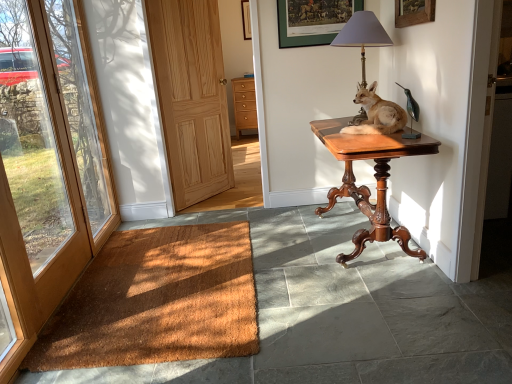
Question: Considering their positions, is wooden picture frame at upper center, which appears as the 1th picture frame when viewed from the left, located in front of or behind light brown wood door at center, the 2th door when ordered from left to right?

Choices:
 (A) front
 (B) behind

Answer: (B)

Question: Looking at their shapes, would you say wooden picture frame at upper center, which is counted as the 2th picture frame, starting from the front, is wider or thinner than light brown wood door at center, the 1th door positioned from the right?

Choices:
 (A) thin
 (B) wide

Answer: (A)

Question: Which is farther from the light brown wood door at center, the 1th door in the back-to-front sequence?

Choices:
 (A) light wood/dark finish cabinet at center
 (B) wooden picture frame at upper center, acting as the 2th picture frame starting from the right
 (C) mahogany wood table at center
 (D) green matte picture frame at upper center, the first picture frame viewed from the front
 (E) brown coir doormat at lower left

Answer: (A)

Question: Considering the real-world distances, which object is closest to the light brown wood door at center, the 1th door in the back-to-front sequence?

Choices:
 (A) matte gray lampshade at upper right
 (B) light wood/dark finish cabinet at center
 (C) mahogany wood table at center
 (D) wooden door at left, which is the second door in right-to-left order
 (E) green matte picture frame at upper center, the first picture frame viewed from the front

Answer: (D)